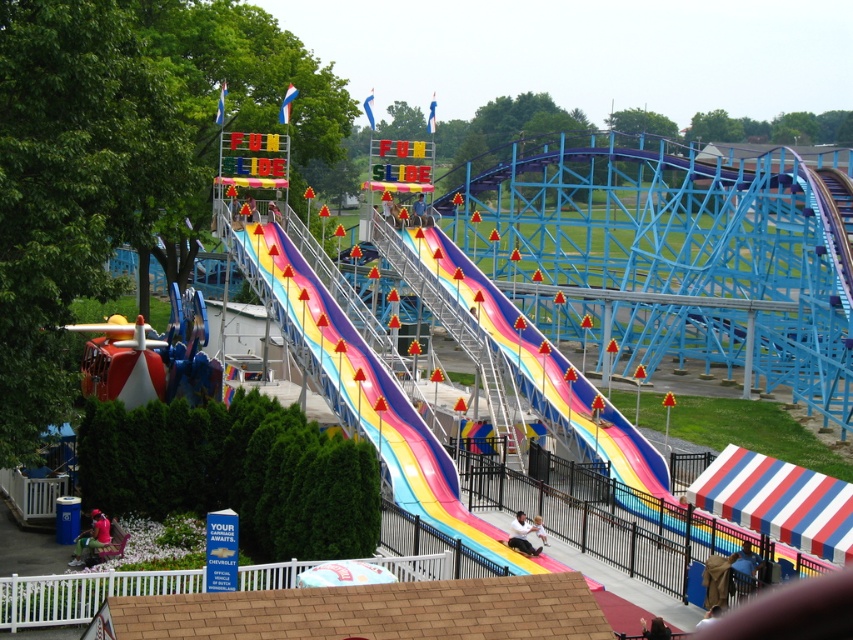
Who is positioned more to the right, brown fabric bag at lower right or matte pink shirt at lower left?

From the viewer's perspective, brown fabric bag at lower right appears more on the right side.

Is brown fabric bag at lower right taller than matte pink shirt at lower left?

Correct, brown fabric bag at lower right is much taller as matte pink shirt at lower left.

Who is more forward, (708, 561) or (76, 536)?

Point (708, 561)

Where is `brown fabric bag at lower right`? This screenshot has height=640, width=853. brown fabric bag at lower right is located at coordinates (717, 579).

Which is more to the left, rainbow striped slide at center or smooth white shirt at center?

Positioned to the left is rainbow striped slide at center.

Can you confirm if rainbow striped slide at center is wider than smooth white shirt at center?

Yes.

What do you see at coordinates (525, 356) in the screenshot?
I see `rainbow striped slide at center` at bounding box center [525, 356].

Locate an element on the screen. The image size is (853, 640). rainbow striped slide at center is located at coordinates (525, 356).

Between point (84, 541) and point (523, 516), which one is positioned in front?

Point (84, 541) is more forward.

Is point (73, 554) less distant than point (512, 522)?

Yes, it is.

You are a GUI agent. You are given a task and a screenshot of the screen. Output one action in this format:
    pyautogui.click(x=<x>, y=<y>)
    Task: Click on the matte pink shirt at lower left
    Image resolution: width=853 pixels, height=640 pixels.
    Given the screenshot: What is the action you would take?
    pyautogui.click(x=91, y=536)